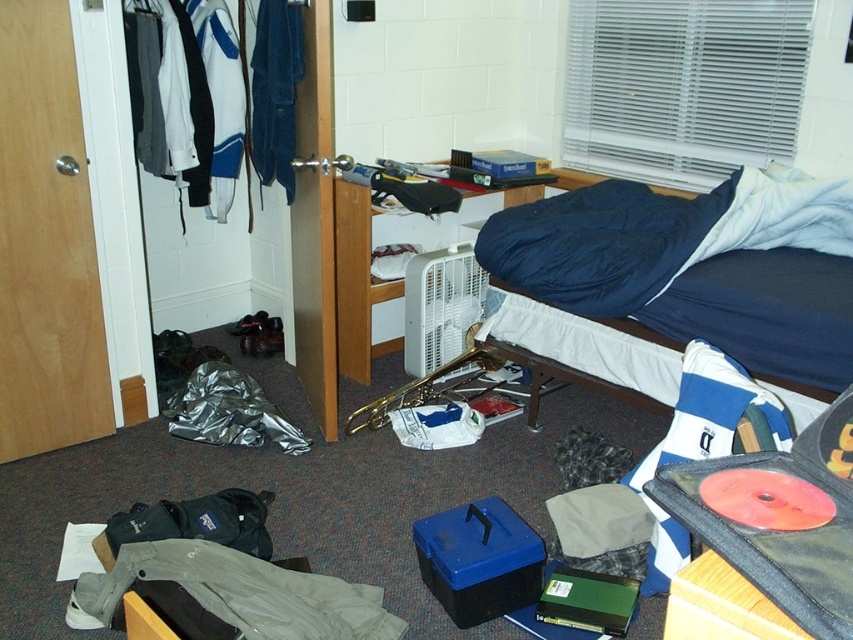
Image resolution: width=853 pixels, height=640 pixels. I want to click on dark blue fabric bed at upper right, so click(x=677, y=259).

Does dark blue fabric bed at upper right appear under khaki cotton jacket at lower left?

Incorrect, dark blue fabric bed at upper right is not positioned below khaki cotton jacket at lower left.

Describe the element at coordinates (677, 259) in the screenshot. This screenshot has height=640, width=853. I see `dark blue fabric bed at upper right` at that location.

Find the location of a particular element. dark blue fabric bed at upper right is located at coordinates (677, 259).

Which is above, dark blue fabric bed at upper right or blue fabric jacket at left?

blue fabric jacket at left is higher up.

You are a GUI agent. You are given a task and a screenshot of the screen. Output one action in this format:
    pyautogui.click(x=<x>, y=<y>)
    Task: Click on the dark blue fabric bed at upper right
    The width and height of the screenshot is (853, 640).
    Given the screenshot: What is the action you would take?
    pyautogui.click(x=677, y=259)

Which of these two, khaki cotton jacket at lower left or blue fabric jacket at left, stands taller?

blue fabric jacket at left is taller.

Does khaki cotton jacket at lower left appear over blue fabric jacket at left?

Incorrect, khaki cotton jacket at lower left is not positioned above blue fabric jacket at left.

Does point (223, 564) come in front of point (277, 58)?

Yes, point (223, 564) is in front of point (277, 58).

Locate an element on the screen. khaki cotton jacket at lower left is located at coordinates (242, 593).